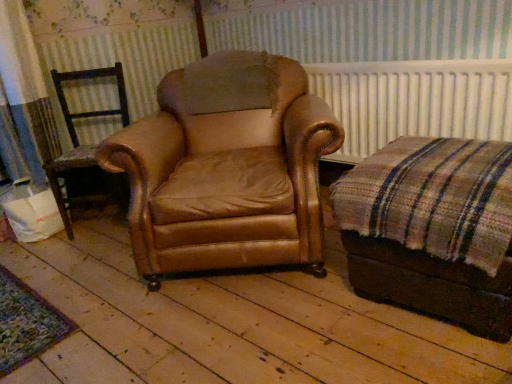
Identify the location of vacant region to the left of plaid fabric ottoman at right. This screenshot has height=384, width=512. (287, 333).